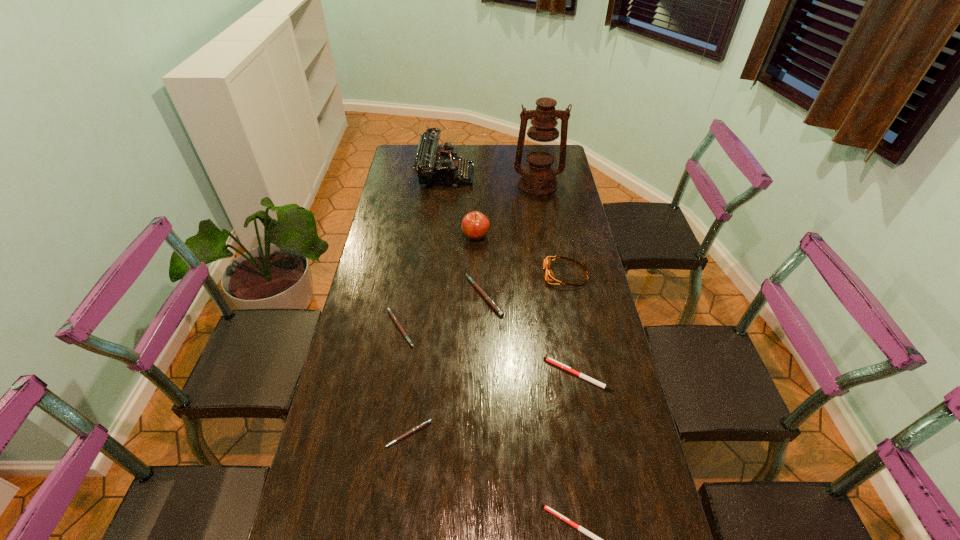
You are a GUI agent. You are given a task and a screenshot of the screen. Output one action in this format:
    pyautogui.click(x=<x>, y=<y>)
    Task: Click on the vacant space that's between the second biggest pink pen and the oil lamp
    
    Given the screenshot: What is the action you would take?
    pyautogui.click(x=468, y=256)

This screenshot has height=540, width=960. Identify the location of free space between the tallest object and the smallest pink pen. (473, 309).

At what (x,y) coordinates should I click in order to perform the action: click on free spot between the oil lamp and the second nearest object. Please return your answer as a coordinate pair (x, y). This screenshot has width=960, height=540. Looking at the image, I should click on (473, 309).

Locate which object is the fourth closest to the fourth farthest pen. Please provide its 2D coordinates. Your answer should be formatted as a tuple, i.e. [(x, y)], where the tuple contains the x and y coordinates of a point satisfying the conditions above.

[(490, 301)]

Select which object appears as the sixth closest to the second tallest object. Please provide its 2D coordinates. Your answer should be formatted as a tuple, i.e. [(x, y)], where the tuple contains the x and y coordinates of a point satisfying the conditions above.

[(550, 360)]

Where is `pen object that ranks as the closest to the smallest pink pen`? Image resolution: width=960 pixels, height=540 pixels. pen object that ranks as the closest to the smallest pink pen is located at coordinates (392, 315).

Find the location of a particular element. pen that is the fourth closest to the third nearest pen is located at coordinates (392, 315).

Locate which pink pen is the second closest to the rightmost pink pen. Please provide its 2D coordinates. Your answer should be formatted as a tuple, i.e. [(x, y)], where the tuple contains the x and y coordinates of a point satisfying the conditions above.

[(415, 429)]

Identify which pink pen is the second closest to the bigger white pen. Please provide its 2D coordinates. Your answer should be formatted as a tuple, i.e. [(x, y)], where the tuple contains the x and y coordinates of a point satisfying the conditions above.

[(415, 429)]

This screenshot has height=540, width=960. I want to click on white pen that is the closest to the third farthest object, so point(550,360).